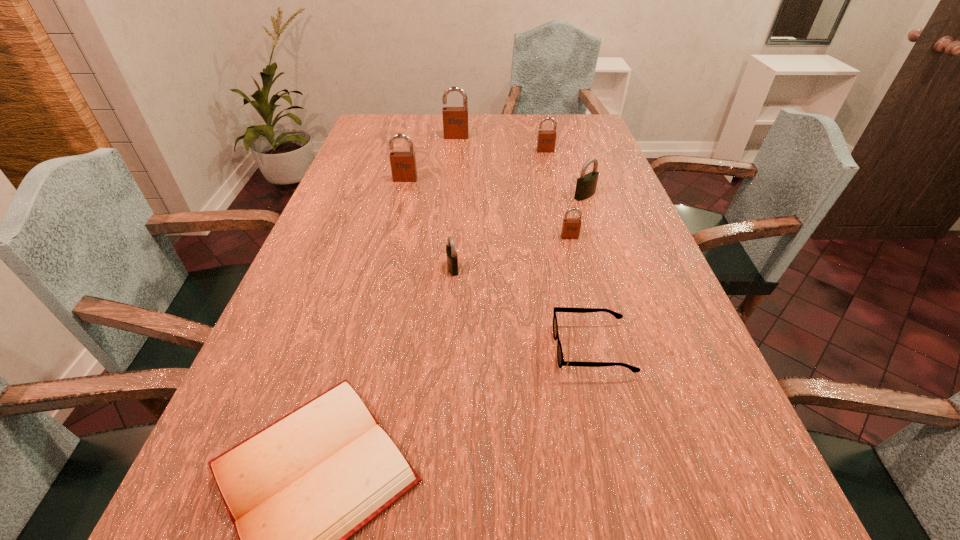
Identify which padlock is the second nearest to the seventh nearest object. Please provide its 2D coordinates. Your answer should be formatted as a tuple, i.e. [(x, y)], where the tuple contains the x and y coordinates of a point satisfying the conditions above.

[(455, 119)]

Select which brown padlock is the third closest to the smallest brown padlock. Please provide its 2D coordinates. Your answer should be formatted as a tuple, i.e. [(x, y)], where the tuple contains the x and y coordinates of a point satisfying the conditions above.

[(455, 119)]

Point out which brown padlock is positioned as the second nearest to the third farthest object. Please provide its 2D coordinates. Your answer should be formatted as a tuple, i.e. [(x, y)], where the tuple contains the x and y coordinates of a point satisfying the conditions above.

[(546, 141)]

I want to click on vacant space that satisfies the following two spatial constraints: 1. on the front-facing side of the sixth farthest object; 2. on the right side of the third smallest brown padlock, so click(x=383, y=268).

The height and width of the screenshot is (540, 960). What are the coordinates of `vacant area in the image that satisfies the following two spatial constraints: 1. on the front-facing side of the second nearest padlock; 2. on the arms of the seventh farthest object` in the screenshot? It's located at (598, 349).

Find the location of `vacant region that satisfies the following two spatial constraints: 1. on the front-facing side of the smallest brown padlock; 2. on the arms of the seventh farthest object`. vacant region that satisfies the following two spatial constraints: 1. on the front-facing side of the smallest brown padlock; 2. on the arms of the seventh farthest object is located at coordinates (598, 349).

I want to click on free space that satisfies the following two spatial constraints: 1. on the back side of the farther black padlock; 2. on the right side of the nearest padlock, so click(x=458, y=195).